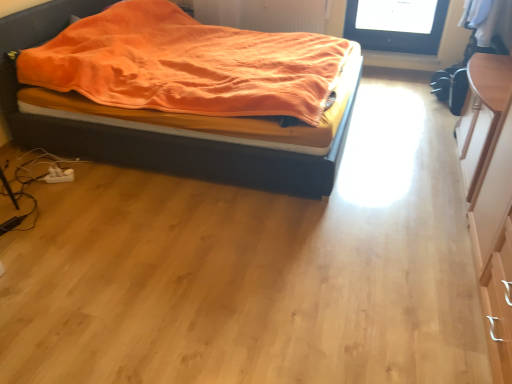
Describe the element at coordinates (490, 196) in the screenshot. I see `light wood dresser at right` at that location.

In order to face light wood dresser at right, should I rotate leftwards or rightwards?

Turn right by 33.858 degrees to look at light wood dresser at right.

Where is `light wood dresser at right`? The width and height of the screenshot is (512, 384). light wood dresser at right is located at coordinates (490, 196).

Locate an element on the screen. The image size is (512, 384). orange soft fabric bed at left is located at coordinates (152, 132).

The image size is (512, 384). What do you see at coordinates (152, 132) in the screenshot? I see `orange soft fabric bed at left` at bounding box center [152, 132].

In order to face orange soft fabric bed at left, should I rotate leftwards or rightwards?

You should rotate left by 6.190 degrees.

Where is `light wood dresser at right`? light wood dresser at right is located at coordinates (490, 196).

In the image, is light wood dresser at right on the left side or the right side of orange soft fabric bed at left?

Clearly, light wood dresser at right is on the right of orange soft fabric bed at left in the image.

Is the depth of light wood dresser at right less than that of orange soft fabric bed at left?

Yes, it is in front of orange soft fabric bed at left.

Considering the positions of point (482, 169) and point (57, 134), is point (482, 169) closer or farther from the camera than point (57, 134)?

Point (482, 169) appears to be closer to the viewer than point (57, 134).

From the image's perspective, between light wood dresser at right and orange soft fabric bed at left, who is located below?

light wood dresser at right.

Based on the photo, from a real-world perspective, is light wood dresser at right positioned above or below orange soft fabric bed at left?

light wood dresser at right is above orange soft fabric bed at left.

Looking at their sizes, would you say light wood dresser at right is wider or thinner than orange soft fabric bed at left?

Considering their sizes, light wood dresser at right looks slimmer than orange soft fabric bed at left.

Considering the relative sizes of light wood dresser at right and orange soft fabric bed at left in the image provided, is light wood dresser at right taller than orange soft fabric bed at left?

Yes.

In the scene shown: Looking at the image, does light wood dresser at right seem bigger or smaller compared to orange soft fabric bed at left?

Considering their sizes, light wood dresser at right takes up less space than orange soft fabric bed at left.

Would you say light wood dresser at right is outside orange soft fabric bed at left?

light wood dresser at right lies outside orange soft fabric bed at left's area.

Would you consider light wood dresser at right to be distant from orange soft fabric bed at left?

Yes, light wood dresser at right and orange soft fabric bed at left are located far from each other.

Is light wood dresser at right looking in the opposite direction of orange soft fabric bed at left?

No, orange soft fabric bed at left is not at the back of light wood dresser at right.

Can you tell me how much light wood dresser at right and orange soft fabric bed at left differ in facing direction?

The facing directions of light wood dresser at right and orange soft fabric bed at left are 179 degrees apart.

Where is `bed on the left of light wood dresser at right`? This screenshot has width=512, height=384. bed on the left of light wood dresser at right is located at coordinates (152, 132).

Can you confirm if orange soft fabric bed at left is positioned to the left of light wood dresser at right?

Correct, you'll find orange soft fabric bed at left to the left of light wood dresser at right.

Considering their positions, is orange soft fabric bed at left located in front of or behind light wood dresser at right?

In the image, orange soft fabric bed at left appears behind light wood dresser at right.

Is point (26, 12) in front of point (487, 112)?

No, it is not.

From the image's perspective, is orange soft fabric bed at left under light wood dresser at right?

No.

From a real-world perspective, is orange soft fabric bed at left physically below light wood dresser at right?

Indeed, from a real-world perspective, orange soft fabric bed at left is positioned beneath light wood dresser at right.

Considering the sizes of orange soft fabric bed at left and light wood dresser at right in the image, is orange soft fabric bed at left wider or thinner than light wood dresser at right?

In the image, orange soft fabric bed at left appears to be wider than light wood dresser at right.

From their relative heights in the image, would you say orange soft fabric bed at left is taller or shorter than light wood dresser at right?

orange soft fabric bed at left is shorter than light wood dresser at right.

Considering the sizes of objects orange soft fabric bed at left and light wood dresser at right in the image provided, who is smaller, orange soft fabric bed at left or light wood dresser at right?

light wood dresser at right is smaller.

Choose the correct answer: Is orange soft fabric bed at left inside light wood dresser at right or outside it?

orange soft fabric bed at left is not inside light wood dresser at right, it's outside.

Is orange soft fabric bed at left next to light wood dresser at right?

There is a gap between orange soft fabric bed at left and light wood dresser at right.

Is orange soft fabric bed at left positioned with its back to light wood dresser at right?

No, light wood dresser at right is not at the back of orange soft fabric bed at left.

How different are the orientations of orange soft fabric bed at left and light wood dresser at right in degrees?

There is a 179-degree angle between the facing directions of orange soft fabric bed at left and light wood dresser at right.

Identify the location of dresser in front of the orange soft fabric bed at left. (490, 196).

You are a GUI agent. You are given a task and a screenshot of the screen. Output one action in this format:
    pyautogui.click(x=<x>, y=<y>)
    Task: Click on the bed lying above the light wood dresser at right (from the image's perspective)
    The height and width of the screenshot is (384, 512).
    Given the screenshot: What is the action you would take?
    pyautogui.click(x=152, y=132)

You are a GUI agent. You are given a task and a screenshot of the screen. Output one action in this format:
    pyautogui.click(x=<x>, y=<y>)
    Task: Click on the dresser below the orange soft fabric bed at left (from the image's perspective)
    The width and height of the screenshot is (512, 384).
    Given the screenshot: What is the action you would take?
    pyautogui.click(x=490, y=196)